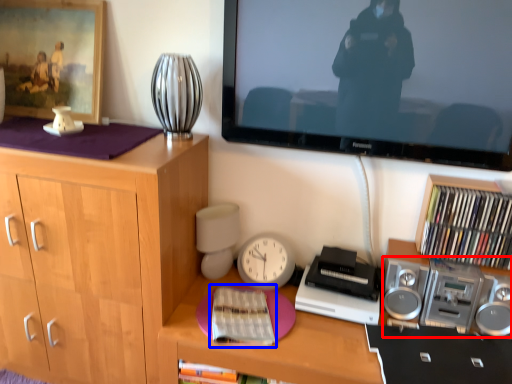
Question: Which object is further to the camera taking this photo, stereo (highlighted by a red box) or book (highlighted by a blue box)?

Choices:
 (A) stereo
 (B) book

Answer: (A)